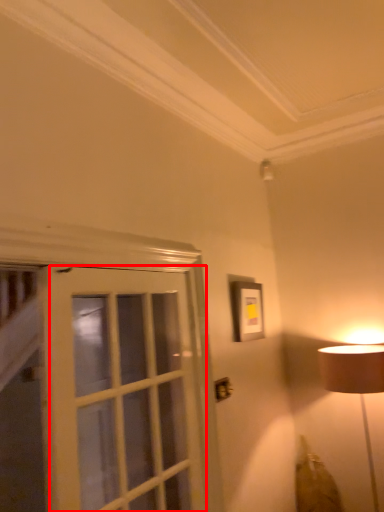
Question: In this image, where is screen door (annotated by the red box) located relative to picture frame?

Choices:
 (A) right
 (B) left

Answer: (B)